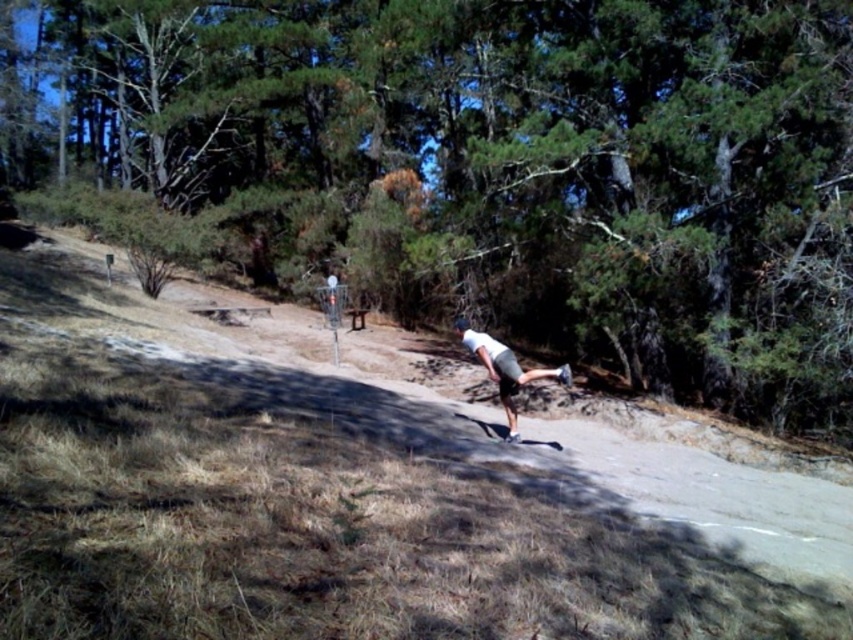
Question: Does green leafy tree at center have a larger size compared to white matte skateboard at center?

Choices:
 (A) no
 (B) yes

Answer: (B)

Question: Is green leafy tree at center to the right of white matte skateboard at center from the viewer's perspective?

Choices:
 (A) no
 (B) yes

Answer: (A)

Question: Which object appears farthest from the camera in this image?

Choices:
 (A) green leafy tree at center
 (B) white matte skateboard at center

Answer: (A)

Question: Is green leafy tree at center further to camera compared to white matte skateboard at center?

Choices:
 (A) no
 (B) yes

Answer: (B)